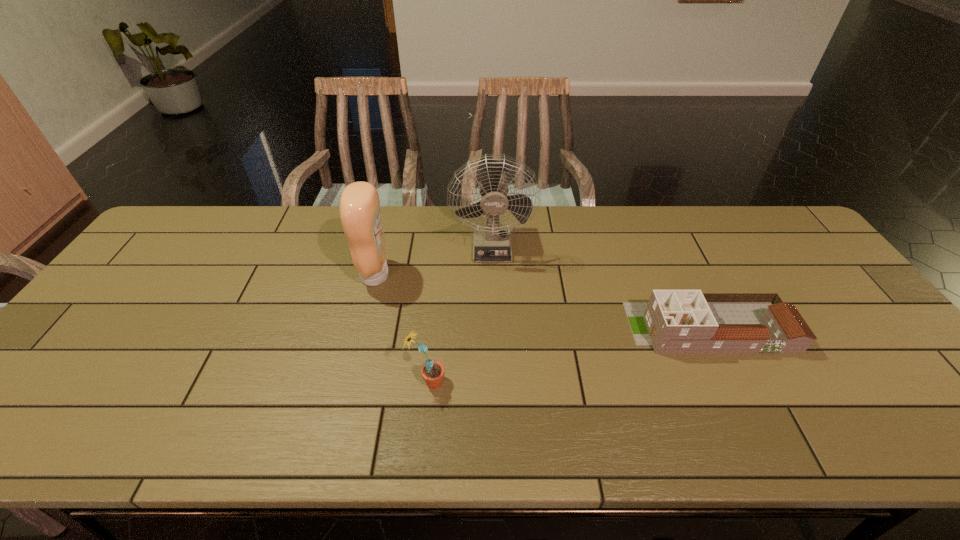
Identify which object is located as the second nearest to the leftmost object. Please provide its 2D coordinates. Your answer should be formatted as a tuple, i.e. [(x, y)], where the tuple contains the x and y coordinates of a point satisfying the conditions above.

[(433, 371)]

The image size is (960, 540). I want to click on object that is the nearest to the dollhouse, so click(x=491, y=244).

The image size is (960, 540). Find the location of `vacant space that satisfies the following two spatial constraints: 1. on the air flow direction of the fan; 2. on the label of the second tallest object`. vacant space that satisfies the following two spatial constraints: 1. on the air flow direction of the fan; 2. on the label of the second tallest object is located at coordinates (493, 275).

Identify the location of vacant area in the image that satisfies the following two spatial constraints: 1. on the air flow direction of the fan; 2. on the label of the leftmost object. Image resolution: width=960 pixels, height=540 pixels. (493, 275).

The width and height of the screenshot is (960, 540). I want to click on free space that satisfies the following two spatial constraints: 1. on the air flow direction of the fan; 2. on the flower of the third tallest object, so click(496, 382).

This screenshot has height=540, width=960. What are the coordinates of `blank space that satisfies the following two spatial constraints: 1. on the air flow direction of the fan; 2. on the flower of the nearest object` in the screenshot? It's located at (496, 382).